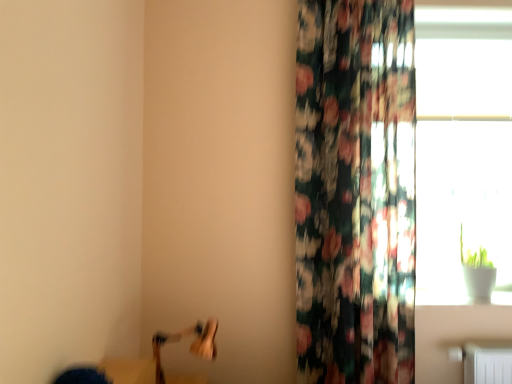
I want to click on transparent glass window at upper right, so click(463, 149).

Is floral fabric curtain at right in front of or behind wooden swivel chair at lower left in the image?

floral fabric curtain at right is behind wooden swivel chair at lower left.

Consider the image. From a real-world perspective, who is located lower, floral fabric curtain at right or wooden swivel chair at lower left?

From a 3D spatial view, wooden swivel chair at lower left is below.

Can you confirm if floral fabric curtain at right is positioned to the right of wooden swivel chair at lower left?

Yes, floral fabric curtain at right is to the right of wooden swivel chair at lower left.

Measure the distance from floral fabric curtain at right to wooden swivel chair at lower left.

floral fabric curtain at right and wooden swivel chair at lower left are 34.01 inches apart.

Could you tell me if transparent glass window at upper right is turned towards wooden swivel chair at lower left?

No, transparent glass window at upper right does not turn towards wooden swivel chair at lower left.

From the picture: From a real-world perspective, which is physically below, transparent glass window at upper right or wooden swivel chair at lower left?

wooden swivel chair at lower left, from a real-world perspective.

Is transparent glass window at upper right wider than wooden swivel chair at lower left?

In fact, transparent glass window at upper right might be narrower than wooden swivel chair at lower left.

Is transparent glass window at upper right shorter than floral fabric curtain at right?

Indeed, transparent glass window at upper right has a lesser height compared to floral fabric curtain at right.

Which object is thinner, transparent glass window at upper right or floral fabric curtain at right?

transparent glass window at upper right is thinner.

Consider the image. Is transparent glass window at upper right situated inside floral fabric curtain at right or outside?

transparent glass window at upper right lies outside floral fabric curtain at right.

Considering the relative sizes of wooden swivel chair at lower left and floral fabric curtain at right in the image provided, is wooden swivel chair at lower left bigger than floral fabric curtain at right?

No, wooden swivel chair at lower left is not bigger than floral fabric curtain at right.

From a real-world perspective, is wooden swivel chair at lower left beneath floral fabric curtain at right?

Yes, from a real-world perspective, wooden swivel chair at lower left is under floral fabric curtain at right.

Is wooden swivel chair at lower left not within floral fabric curtain at right?

Absolutely, wooden swivel chair at lower left is external to floral fabric curtain at right.

Does floral fabric curtain at right have a lesser height compared to transparent glass window at upper right?

In fact, floral fabric curtain at right may be taller than transparent glass window at upper right.

Which object is closer to the camera taking this photo, floral fabric curtain at right or transparent glass window at upper right?

floral fabric curtain at right is closer to the camera.

From the image's perspective, who appears lower, floral fabric curtain at right or transparent glass window at upper right?

floral fabric curtain at right.

Is wooden swivel chair at lower left spatially inside transparent glass window at upper right, or outside of it?

wooden swivel chair at lower left lies outside transparent glass window at upper right.

From a real-world perspective, which object rests below the other?

wooden swivel chair at lower left is physically lower.

Is wooden swivel chair at lower left aimed at transparent glass window at upper right?

No, wooden swivel chair at lower left is not turned towards transparent glass window at upper right.

Locate an element on the screen. The image size is (512, 384). swivel chair on the left of the floral fabric curtain at right is located at coordinates (190, 346).

This screenshot has width=512, height=384. In order to click on window positioned vertically above the wooden swivel chair at lower left (from a real-world perspective) in this screenshot , I will do `click(463, 149)`.

Consider the image. Which object lies nearer to the anchor point transparent glass window at upper right, wooden swivel chair at lower left or floral fabric curtain at right?

The object closer to transparent glass window at upper right is floral fabric curtain at right.

Which object lies nearer to the anchor point floral fabric curtain at right, transparent glass window at upper right or wooden swivel chair at lower left?

Based on the image, transparent glass window at upper right appears to be nearer to floral fabric curtain at right.

When comparing their distances from wooden swivel chair at lower left, does transparent glass window at upper right or floral fabric curtain at right seem closer?

Among the two, floral fabric curtain at right is located nearer to wooden swivel chair at lower left.

Considering their positions, is floral fabric curtain at right positioned closer to transparent glass window at upper right than wooden swivel chair at lower left?

Based on the image, floral fabric curtain at right appears to be nearer to transparent glass window at upper right.

Based on their spatial positions, is wooden swivel chair at lower left or transparent glass window at upper right closer to floral fabric curtain at right?

Based on the image, transparent glass window at upper right appears to be nearer to floral fabric curtain at right.

Looking at this image, which object lies nearer to the anchor point wooden swivel chair at lower left, floral fabric curtain at right or transparent glass window at upper right?

floral fabric curtain at right lies closer to wooden swivel chair at lower left than the other object.

I want to click on curtain between wooden swivel chair at lower left and transparent glass window at upper right, so click(x=355, y=191).